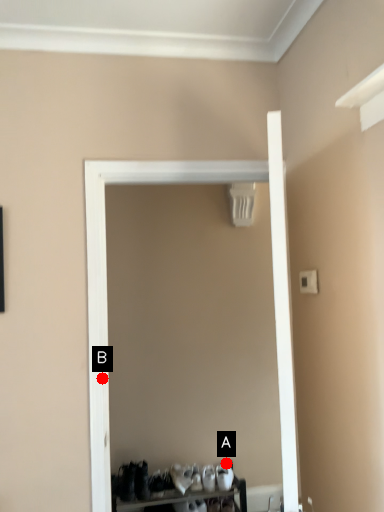
Question: Two points are circled on the image, labeled by A and B beside each circle. Which point appears closest to the camera in this image?

Choices:
 (A) A is closer
 (B) B is closer

Answer: (B)